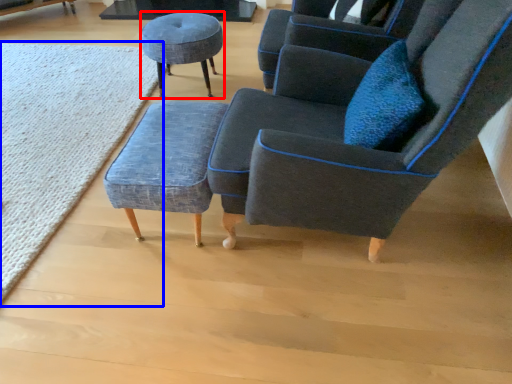
Question: Which object appears farthest to the camera in this image, stool (highlighted by a red box) or mat (highlighted by a blue box)?

Choices:
 (A) stool
 (B) mat

Answer: (A)